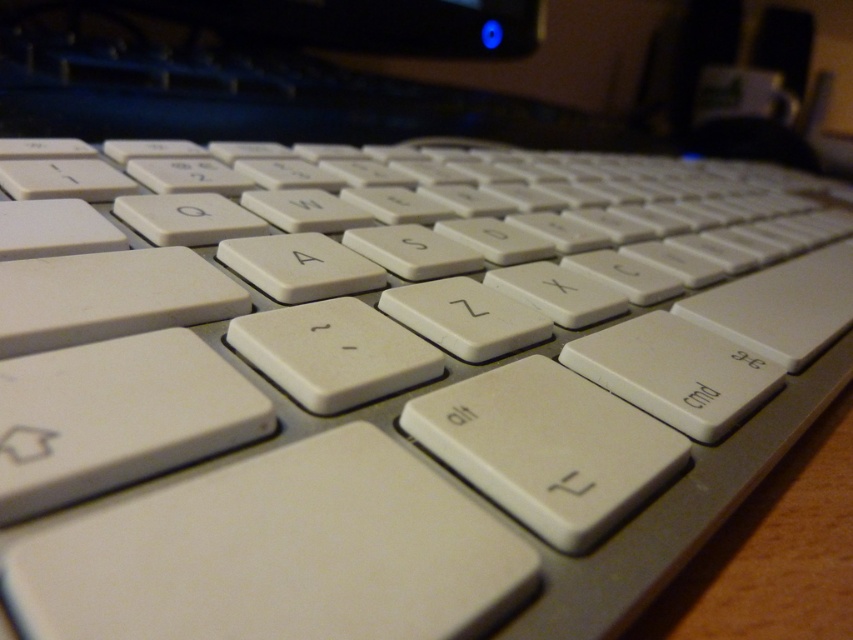
Question: Which object appears closest to the camera in this image?

Choices:
 (A) white plastic keyboard at upper center
 (B) white matte keyboard at right

Answer: (B)

Question: Does white plastic keyboard at upper center come in front of white matte keyboard at right?

Choices:
 (A) no
 (B) yes

Answer: (A)

Question: Considering the relative positions of white plastic keyboard at upper center and white matte keyboard at right in the image provided, where is white plastic keyboard at upper center located with respect to white matte keyboard at right?

Choices:
 (A) left
 (B) right

Answer: (A)

Question: Which of the following is the farthest from the observer?

Choices:
 (A) white matte keyboard at right
 (B) white plastic keyboard at upper center

Answer: (B)

Question: Does white plastic keyboard at upper center lie in front of white matte keyboard at right?

Choices:
 (A) yes
 (B) no

Answer: (B)

Question: Which point is closer to the camera?

Choices:
 (A) (440, 97)
 (B) (811, 496)

Answer: (B)